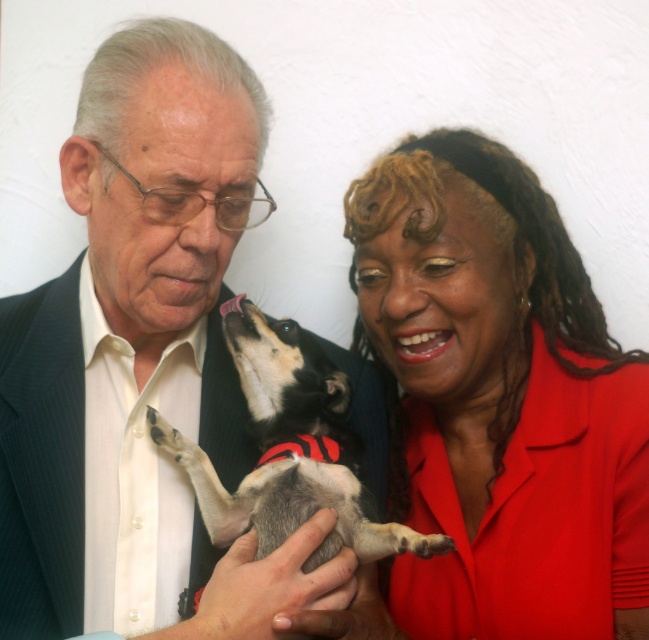
Question: Is smooth red blouse at center closer to the viewer compared to black and white fur at center?

Choices:
 (A) yes
 (B) no

Answer: (A)

Question: Which object is the closest to the black and white fur at center?

Choices:
 (A) smooth red blouse at center
 (B) matte black suit at center

Answer: (B)

Question: In this image, where is matte black suit at center located relative to smooth red blouse at center?

Choices:
 (A) below
 (B) above

Answer: (B)

Question: Can you confirm if matte black suit at center is wider than black and white fur at center?

Choices:
 (A) no
 (B) yes

Answer: (B)

Question: Among these objects, which one is farthest from the camera?

Choices:
 (A) matte black suit at center
 (B) black and white fur at center
 (C) smooth red blouse at center

Answer: (B)

Question: Which point is farther from the camera taking this photo?

Choices:
 (A) (491, 246)
 (B) (273, 371)
 (C) (184, 403)

Answer: (A)